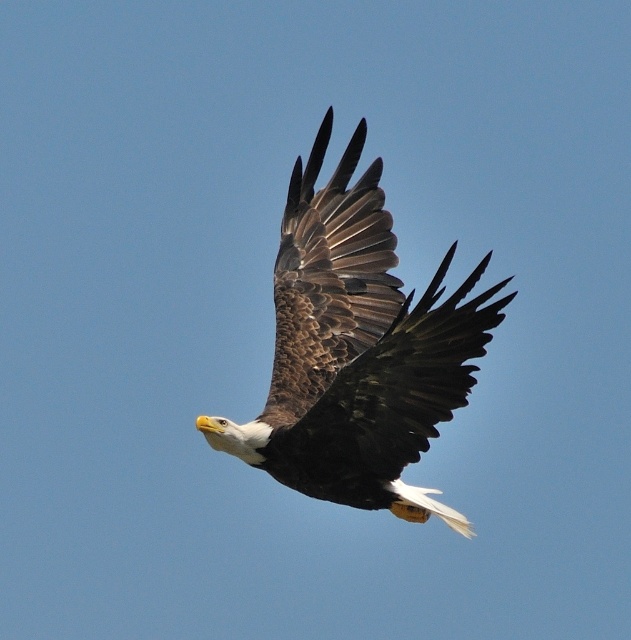
Question: Is brown feathered eagle at center smaller than brown feathered wing at center?

Choices:
 (A) yes
 (B) no

Answer: (B)

Question: Is brown feathered eagle at center to the right of brown feathered wing at center from the viewer's perspective?

Choices:
 (A) no
 (B) yes

Answer: (B)

Question: Which point is closer to the camera?

Choices:
 (A) brown feathered eagle at center
 (B) brown feathered wing at center
 (C) brown textured wing at center

Answer: (C)

Question: Does brown feathered eagle at center have a larger size compared to brown textured wing at center?

Choices:
 (A) yes
 (B) no

Answer: (A)

Question: Which is nearer to the brown textured wing at center?

Choices:
 (A) brown feathered eagle at center
 (B) brown feathered wing at center

Answer: (A)

Question: Which object is farther from the camera taking this photo?

Choices:
 (A) brown feathered eagle at center
 (B) brown textured wing at center

Answer: (A)